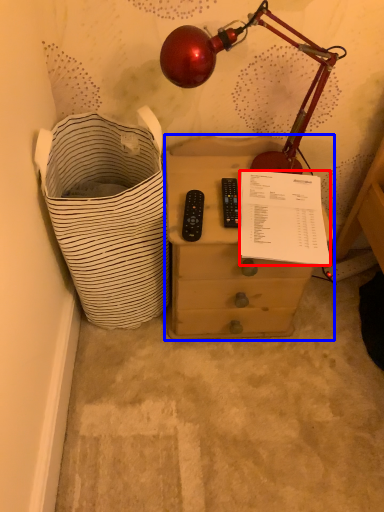
Question: Which of the following is the closest to the observer, writing (highlighted by a red box) or nightstand (highlighted by a blue box)?

Choices:
 (A) writing
 (B) nightstand

Answer: (A)